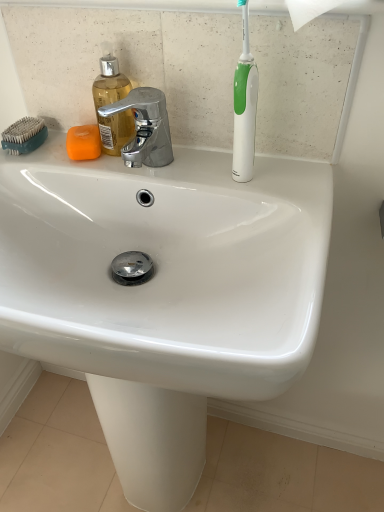
At what (x,y) coordinates should I click in order to perform the action: click on vacant space to the right of orange matte soap at upper left. Please return your answer as a coordinate pair (x, y). This screenshot has height=512, width=384. Looking at the image, I should click on (182, 163).